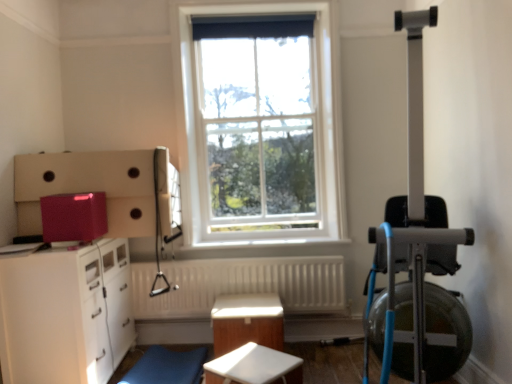
Question: Is white matte table at center, placed as the 1th table when sorted from front to back, further to the viewer compared to blue fabric swivel chair at lower center?

Choices:
 (A) no
 (B) yes

Answer: (A)

Question: Considering the relative positions of white matte table at center, marked as the second table in a back-to-front arrangement, and blue fabric swivel chair at lower center in the image provided, is white matte table at center, marked as the second table in a back-to-front arrangement, to the right of blue fabric swivel chair at lower center from the viewer's perspective?

Choices:
 (A) no
 (B) yes

Answer: (B)

Question: Is white matte table at center, placed as the 1th table when sorted from front to back, outside blue fabric swivel chair at lower center?

Choices:
 (A) yes
 (B) no

Answer: (A)

Question: Does white matte table at center, placed as the 1th table when sorted from front to back, come in front of blue fabric swivel chair at lower center?

Choices:
 (A) yes
 (B) no

Answer: (A)

Question: From the image's perspective, is white matte table at center, placed as the 1th table when sorted from front to back, located beneath blue fabric swivel chair at lower center?

Choices:
 (A) yes
 (B) no

Answer: (B)

Question: Is point (279, 307) closer or farther from the camera than point (96, 208)?

Choices:
 (A) closer
 (B) farther

Answer: (B)

Question: In the image, is white glossy table at center, the 1th table viewed from the back, positioned in front of or behind glossy plastic container at upper left?

Choices:
 (A) behind
 (B) front

Answer: (A)

Question: Considering the positions of white glossy table at center, which ranks as the 2th table in front-to-back order, and glossy plastic container at upper left in the image, is white glossy table at center, which ranks as the 2th table in front-to-back order, bigger or smaller than glossy plastic container at upper left?

Choices:
 (A) big
 (B) small

Answer: (A)

Question: In terms of width, does white glossy table at center, which ranks as the 2th table in front-to-back order, look wider or thinner when compared to glossy plastic container at upper left?

Choices:
 (A) wide
 (B) thin

Answer: (A)

Question: Looking at their shapes, would you say glossy plastic container at upper left is wider or thinner than white textured radiator at center?

Choices:
 (A) thin
 (B) wide

Answer: (B)

Question: Is glossy plastic container at upper left taller or shorter than white textured radiator at center?

Choices:
 (A) tall
 (B) short

Answer: (B)

Question: Based on their positions, is glossy plastic container at upper left located to the left or right of white textured radiator at center?

Choices:
 (A) left
 (B) right

Answer: (A)

Question: From the image's perspective, is glossy plastic container at upper left positioned above or below white textured radiator at center?

Choices:
 (A) below
 (B) above

Answer: (B)

Question: In terms of height, does glossy plastic container at upper left look taller or shorter compared to blue fabric swivel chair at lower center?

Choices:
 (A) tall
 (B) short

Answer: (A)

Question: Considering the positions of glossy plastic container at upper left and blue fabric swivel chair at lower center in the image, is glossy plastic container at upper left wider or thinner than blue fabric swivel chair at lower center?

Choices:
 (A) thin
 (B) wide

Answer: (A)